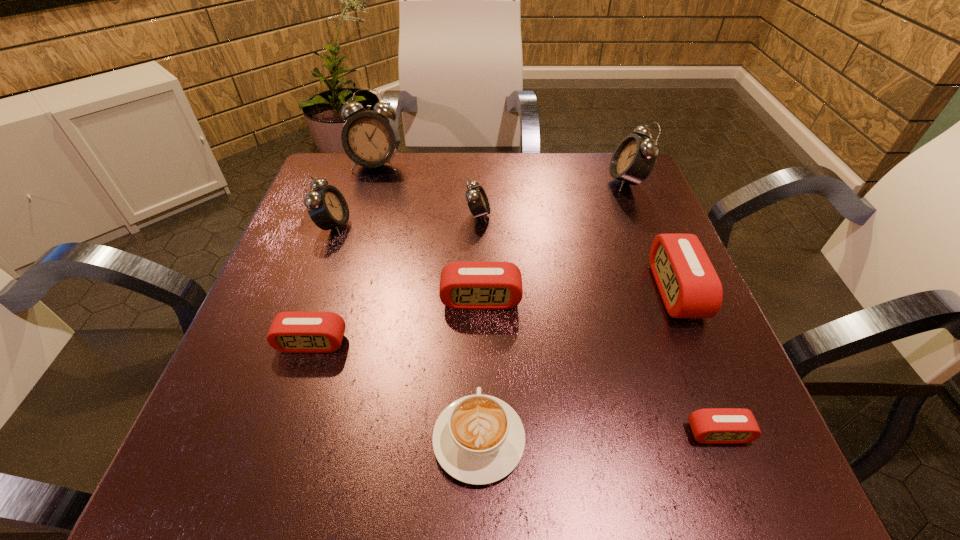
Locate an element on the screen. This screenshot has height=540, width=960. the sixth closest object to the shortest object is located at coordinates (634, 158).

Locate which alarm clock is the fifth closest to the cappuccino. Please provide its 2D coordinates. Your answer should be formatted as a tuple, i.e. [(x, y)], where the tuple contains the x and y coordinates of a point satisfying the conditions above.

[(477, 200)]

Identify which alarm clock is located as the seventh nearest to the eighth shortest object. Please provide its 2D coordinates. Your answer should be formatted as a tuple, i.e. [(x, y)], where the tuple contains the x and y coordinates of a point satisfying the conditions above.

[(292, 332)]

Select which white alarm clock is the closest to the eighth shortest object. Please provide its 2D coordinates. Your answer should be formatted as a tuple, i.e. [(x, y)], where the tuple contains the x and y coordinates of a point satisfying the conditions above.

[(477, 200)]

Identify the location of white alarm clock that is the closest to the second white alarm clock from right to left. The height and width of the screenshot is (540, 960). (370, 139).

This screenshot has width=960, height=540. Find the location of `the fourth closest pink alarm clock to the third tallest alarm clock`. the fourth closest pink alarm clock to the third tallest alarm clock is located at coordinates (713, 425).

Select which pink alarm clock appears as the second closest to the smallest pink alarm clock. Please provide its 2D coordinates. Your answer should be formatted as a tuple, i.e. [(x, y)], where the tuple contains the x and y coordinates of a point satisfying the conditions above.

[(480, 285)]

What are the coordinates of `free space that satisfies the following two spatial constraints: 1. on the face of the smallest white alarm clock; 2. on the side of the white cappuccino with the handle` in the screenshot? It's located at (477, 440).

Locate an element on the screen. free spot that satisfies the following two spatial constraints: 1. on the face of the second tallest alarm clock; 2. on the front-facing side of the second nearest pink alarm clock is located at coordinates (693, 343).

The width and height of the screenshot is (960, 540). Find the location of `blank area in the image that satisfies the following two spatial constraints: 1. on the face of the second tallest object; 2. on the front-facing side of the sixth tallest alarm clock`. blank area in the image that satisfies the following two spatial constraints: 1. on the face of the second tallest object; 2. on the front-facing side of the sixth tallest alarm clock is located at coordinates (675, 299).